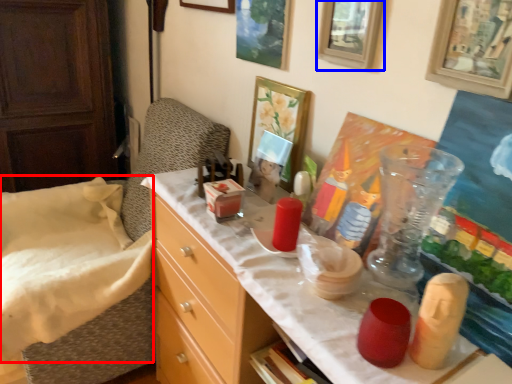
Question: Which object is closer to the camera taking this photo, sheet (highlighted by a red box) or picture frame (highlighted by a blue box)?

Choices:
 (A) sheet
 (B) picture frame

Answer: (B)